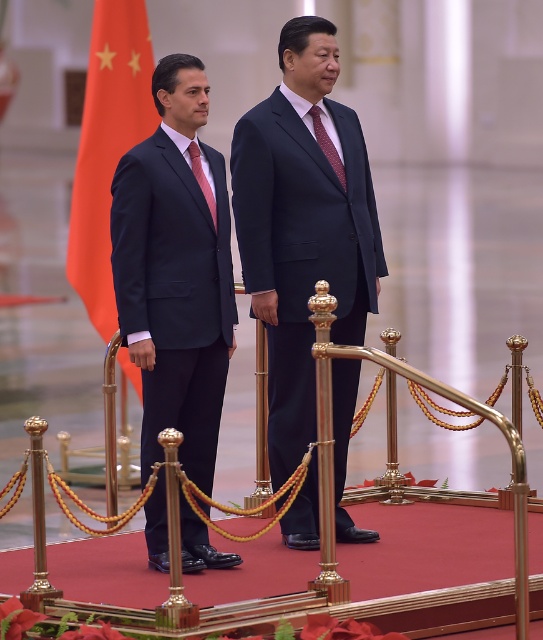
Question: Which object appears farthest from the camera in this image?

Choices:
 (A) black matte suit at center
 (B) maroon textured tie at center
 (C) matte black suit at left
 (D) orange fabric flag at left

Answer: (D)

Question: Is black matte suit at center positioned at the back of pink satin tie at center?

Choices:
 (A) yes
 (B) no

Answer: (B)

Question: In this image, where is black matte suit at center located relative to matte black suit at left?

Choices:
 (A) right
 (B) left

Answer: (A)

Question: Which object is positioned farthest from the maroon textured tie at center?

Choices:
 (A) black matte suit at center
 (B) pink satin tie at center
 (C) matte black suit at left

Answer: (C)

Question: Among these objects, which one is farthest from the camera?

Choices:
 (A) maroon textured tie at center
 (B) pink satin tie at center

Answer: (A)

Question: Does black matte suit at center have a greater width compared to pink satin tie at center?

Choices:
 (A) no
 (B) yes

Answer: (B)